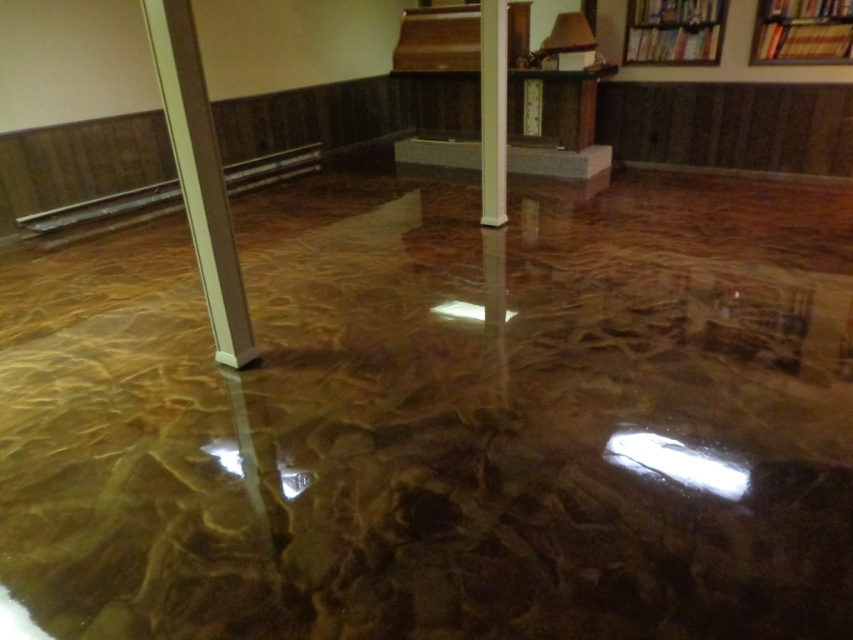
You are standing in the room and want to place a tall plant between the wooden bookshelf at upper right and the white glossy pillar at center. Can you do this?

The wooden bookshelf at upper right is located above the white glossy pillar at center, so there is no space between them to place a tall plant.